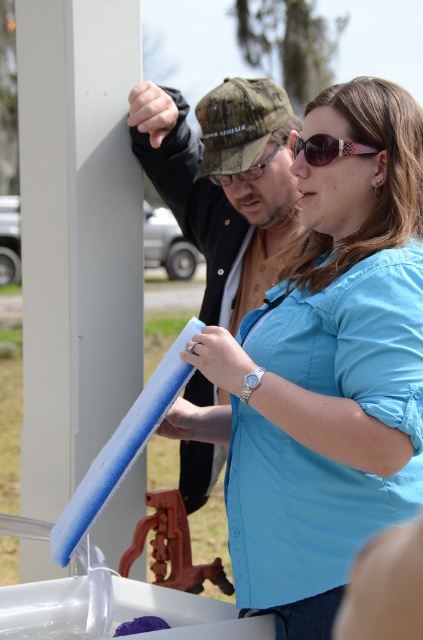
Question: Which of the following is the farthest from the observer?

Choices:
 (A) blue fabric at center
 (B) white smooth pillar at upper left
 (C) matte blue foam at center
 (D) matte black goggles at center

Answer: (D)

Question: Is white smooth pillar at upper left behind matte blue foam at center?

Choices:
 (A) yes
 (B) no

Answer: (B)

Question: Where is blue fabric at center located in relation to matte blue foam at center in the image?

Choices:
 (A) below
 (B) above

Answer: (A)

Question: Which object is farther from the camera taking this photo?

Choices:
 (A) matte black goggles at center
 (B) white smooth pillar at upper left
 (C) blue fabric at center
 (D) purple shiny sunglasses at center

Answer: (A)

Question: Is blue fabric at center to the left of matte black goggles at center from the viewer's perspective?

Choices:
 (A) no
 (B) yes

Answer: (A)

Question: Estimate the real-world distances between objects in this image. Which object is closer to the matte black goggles at center?

Choices:
 (A) matte blue foam at center
 (B) purple shiny sunglasses at center
 (C) blue fabric at center

Answer: (A)